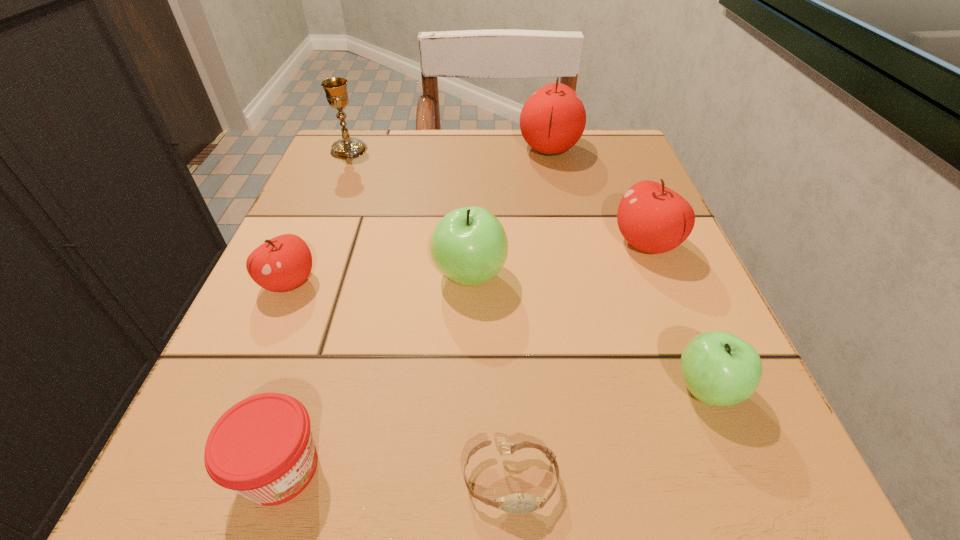
The height and width of the screenshot is (540, 960). I want to click on free space at the far edge of the desktop, so click(512, 161).

The width and height of the screenshot is (960, 540). In order to click on blank space at the near edge of the desktop in this screenshot , I will do `click(560, 465)`.

Image resolution: width=960 pixels, height=540 pixels. Find the location of `free region at the left edge of the desktop`. free region at the left edge of the desktop is located at coordinates (313, 288).

Where is `free space at the right edge of the desktop`? This screenshot has height=540, width=960. free space at the right edge of the desktop is located at coordinates (775, 430).

Locate an element on the screen. vacant space at the far left corner of the desktop is located at coordinates (376, 137).

In order to click on free location at the far right corner in this screenshot , I will do `click(586, 155)`.

Locate an element on the screen. The width and height of the screenshot is (960, 540). free space at the near right corner of the desktop is located at coordinates (787, 517).

Image resolution: width=960 pixels, height=540 pixels. In order to click on free space between the beige watch and the second red apple from left to right in this screenshot , I will do `click(530, 314)`.

The image size is (960, 540). Identify the location of free space that is in between the chalice and the leftmost apple. (319, 216).

The height and width of the screenshot is (540, 960). I want to click on empty space that is in between the right green apple and the jam, so click(x=493, y=428).